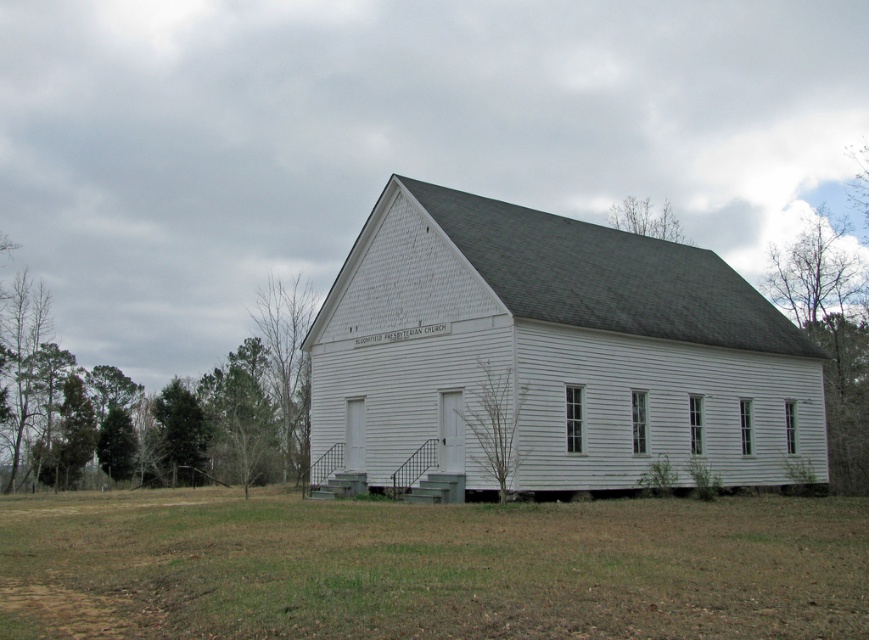
You are standing in the middle of a grassy field and see the white wood barn at center. If you face north, which direction should you walk to reach the barn?

The white wood barn at center is located at point (552, 352), so facing north, you should walk towards the south to reach the barn.

You are a drone operator trying to capture aerial footage of the church. You need to ensure that both the bare branches at lower center and the bare branches at upper center are in frame. Given that your drone camera has a maximum field of view of 60 meters, will you be able to capture both objects in a single shot?

The distance between the bare branches at lower center and the bare branches at upper center is 56.15 meters, which is within the drone camera field of view of 60 meters. Therefore, you can capture both objects in a single shot.